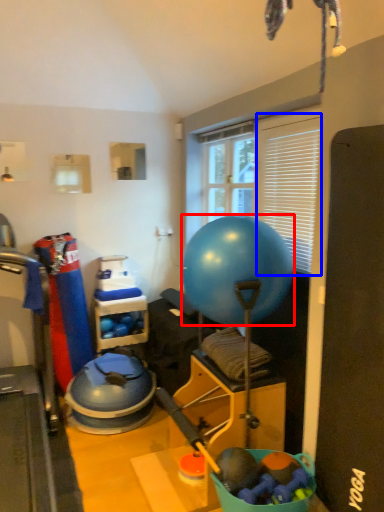
Question: Which object appears closest to the camera in this image, ball (highlighted by a red box) or window screen (highlighted by a blue box)?

Choices:
 (A) ball
 (B) window screen

Answer: (A)